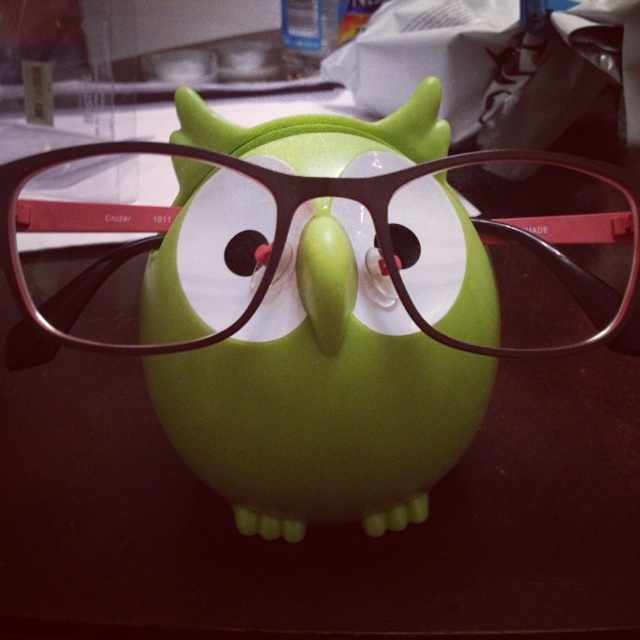
You are a delivery robot tasked with placing a small package on the desk. The package must be placed exactly between the matte black glasses at center and the matte black eye at center. Given that the distance between them is 10.44 inches, what is the minimum distance you need to move the package from either object to ensure it is centered?

The minimum distance required to center the package between the matte black glasses at center and the matte black eye at center is half of 10.44 inches, which is 5.22 inches. This ensures the package is equidistant from both objects.

You are organizing a desk and need to place a matte black glasses at center. Where should you place it to match the image?

The matte black glasses at center should be placed at the coordinates point (288, 244) to match the image.